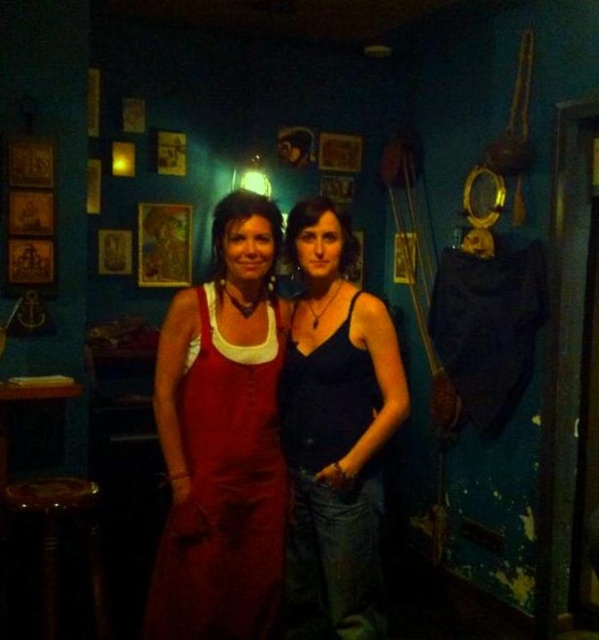
Does matte blue tank top at center appear on the right side of wooden stool at lower left?

Indeed, matte blue tank top at center is positioned on the right side of wooden stool at lower left.

Is matte blue tank top at center bigger than wooden stool at lower left?

Indeed, matte blue tank top at center has a larger size compared to wooden stool at lower left.

Where is `matte blue tank top at center`? The image size is (599, 640). matte blue tank top at center is located at coordinates (335, 433).

The width and height of the screenshot is (599, 640). I want to click on matte blue tank top at center, so click(335, 433).

Find the location of `matte red dress at center`. matte red dress at center is located at coordinates (225, 490).

Between matte red dress at center and wooden stool at lower left, which one is positioned lower?

wooden stool at lower left is below.

Is point (279, 314) farther from viewer compared to point (83, 513)?

No, (279, 314) is closer to viewer.

The image size is (599, 640). Identify the location of matte red dress at center. (225, 490).

Does matte blue tank top at center have a larger size compared to matte red dress at center?

Indeed, matte blue tank top at center has a larger size compared to matte red dress at center.

Does point (355, 502) lie behind point (249, 358)?

No, (355, 502) is closer to viewer.

Between point (346, 296) and point (207, 593), which one is positioned in front?

Point (207, 593) is in front.

Image resolution: width=599 pixels, height=640 pixels. I want to click on matte blue tank top at center, so click(335, 433).